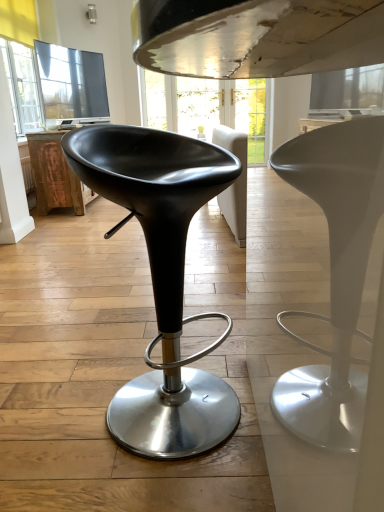
Question: Is black leather stool at center wider or thinner than rustic wood table at left?

Choices:
 (A) thin
 (B) wide

Answer: (A)

Question: Relative to rustic wood table at left, is black leather stool at center in front or behind?

Choices:
 (A) behind
 (B) front

Answer: (B)

Question: Would you say black leather stool at center is inside or outside rustic wood table at left?

Choices:
 (A) outside
 (B) inside

Answer: (A)

Question: Based on their sizes in the image, would you say rustic wood table at left is bigger or smaller than black leather stool at center?

Choices:
 (A) big
 (B) small

Answer: (A)

Question: Considering their positions, is rustic wood table at left located in front of or behind black leather stool at center?

Choices:
 (A) behind
 (B) front

Answer: (A)

Question: Is rustic wood table at left spatially inside black leather stool at center, or outside of it?

Choices:
 (A) inside
 (B) outside

Answer: (B)

Question: From a real-world perspective, is rustic wood table at left above or below black leather stool at center?

Choices:
 (A) above
 (B) below

Answer: (B)